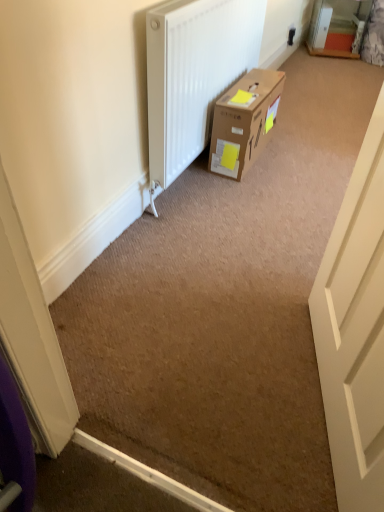
Measure the distance between brown cardboard box at center and camera.

They are 6.53 feet apart.

Image resolution: width=384 pixels, height=512 pixels. What do you see at coordinates (244, 121) in the screenshot?
I see `brown cardboard box at center` at bounding box center [244, 121].

What do you see at coordinates (291, 35) in the screenshot?
I see `white plastic electric outlet at upper right` at bounding box center [291, 35].

I want to click on white matte door at right, so click(x=355, y=329).

I want to click on brown cardboard box at center, so click(244, 121).

Between brown cardboard box at center and white matte door at right, which one has larger size?

white matte door at right is bigger.

From the image's perspective, which one is positioned higher, brown cardboard box at center or white matte door at right?

brown cardboard box at center appears higher in the image.

Is there a large distance between brown cardboard box at center and white matte door at right?

brown cardboard box at center is positioned a significant distance from white matte door at right.

Looking at this image, is brown cardboard box at center inside the boundaries of white matte door at right, or outside?

brown cardboard box at center is outside white matte door at right.

Is white matte door at right to the left of white plastic electric outlet at upper right from the viewer's perspective?

Indeed, white matte door at right is positioned on the left side of white plastic electric outlet at upper right.

From the image's perspective, is white matte door at right located beneath white plastic electric outlet at upper right?

Correct, white matte door at right appears lower than white plastic electric outlet at upper right in the image.

Which is less distant, (379, 243) or (288, 38)?

Point (379, 243).

Where is `door located on the left of white plastic electric outlet at upper right`? door located on the left of white plastic electric outlet at upper right is located at coordinates (355, 329).

From the picture: From the image's perspective, is white plastic electric outlet at upper right above white matte door at right?

Indeed, from the image's perspective, white plastic electric outlet at upper right is shown above white matte door at right.

Is white plastic electric outlet at upper right to the left or to the right of white matte door at right in the image?

In the image, white plastic electric outlet at upper right appears on the right side of white matte door at right.

What's the angular difference between white plastic electric outlet at upper right and white matte door at right's facing directions?

white plastic electric outlet at upper right and white matte door at right are facing 161 degrees away from each other.

Does white plastic electric outlet at upper right turn towards white matte door at right?

No.

From the image's perspective, is brown cardboard box at center on top of white plastic electric outlet at upper right?

No.

Identify the location of electric outlet behind the brown cardboard box at center. The height and width of the screenshot is (512, 384). (291, 35).

Would you say brown cardboard box at center contains white plastic electric outlet at upper right?

No, brown cardboard box at center does not contain white plastic electric outlet at upper right.

How many degrees apart are the facing directions of white plastic electric outlet at upper right and brown cardboard box at center?

They differ by 2.25 degrees in their facing directions.

Which point is more distant from viewer, (292, 29) or (212, 131)?

The point (292, 29) is behind.

Is there a large distance between white plastic electric outlet at upper right and brown cardboard box at center?

Yes.

Based on the photo, considering the positions of objects white plastic electric outlet at upper right and brown cardboard box at center in the image provided, who is behind, white plastic electric outlet at upper right or brown cardboard box at center?

white plastic electric outlet at upper right is more distant.

Considering the sizes of white matte door at right and brown cardboard box at center in the image, is white matte door at right wider or thinner than brown cardboard box at center?

Considering their sizes, white matte door at right looks slimmer than brown cardboard box at center.

Considering the positions of objects white matte door at right and brown cardboard box at center in the image provided, who is more to the left, white matte door at right or brown cardboard box at center?

Positioned to the left is brown cardboard box at center.

Does white matte door at right turn towards brown cardboard box at center?

No, white matte door at right is not aimed at brown cardboard box at center.

From a real-world perspective, is white matte door at right below brown cardboard box at center?

Incorrect, from a real-world perspective, white matte door at right is higher than brown cardboard box at center.

Locate an element on the screen. The image size is (384, 512). box behind the white matte door at right is located at coordinates (244, 121).

This screenshot has width=384, height=512. Find the location of `door positioned vertically above the white plastic electric outlet at upper right (from a real-world perspective)`. door positioned vertically above the white plastic electric outlet at upper right (from a real-world perspective) is located at coordinates (355, 329).

Based on their spatial positions, is white matte door at right or brown cardboard box at center further from white plastic electric outlet at upper right?

The object further to white plastic electric outlet at upper right is white matte door at right.

Considering their positions, is brown cardboard box at center positioned further to white matte door at right than white plastic electric outlet at upper right?

Among the two, white plastic electric outlet at upper right is located further to white matte door at right.

In the scene shown: Based on their spatial positions, is white plastic electric outlet at upper right or brown cardboard box at center closer to white matte door at right?

brown cardboard box at center lies closer to white matte door at right than the other object.

Which object lies further to the anchor point brown cardboard box at center, white matte door at right or white plastic electric outlet at upper right?

white plastic electric outlet at upper right lies further to brown cardboard box at center than the other object.

Looking at the image, which one is located closer to brown cardboard box at center, white plastic electric outlet at upper right or white matte door at right?

white matte door at right.

Based on their spatial positions, is brown cardboard box at center or white matte door at right closer to white plastic electric outlet at upper right?

brown cardboard box at center is closer to white plastic electric outlet at upper right.

At what (x,y) coordinates should I click in order to perform the action: click on box located between white matte door at right and white plastic electric outlet at upper right in the depth direction. Please return your answer as a coordinate pair (x, y). Image resolution: width=384 pixels, height=512 pixels. Looking at the image, I should click on (244, 121).